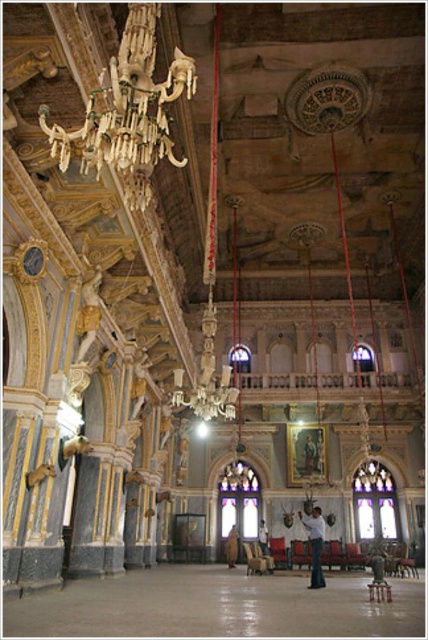
Question: Is light brown leather chair at center bigger than white fabric at center?

Choices:
 (A) no
 (B) yes

Answer: (B)

Question: Can you confirm if light brown leather jacket at center is positioned to the left of wooden framed portrait at center?

Choices:
 (A) no
 (B) yes

Answer: (B)

Question: Estimate the real-world distances between objects in this image. Which object is farther from the gold metallic chandelier at upper center?

Choices:
 (A) white fabric at center
 (B) wooden framed portrait at center
 (C) light brown leather chair at center
 (D) light brown leather jacket at center

Answer: (C)

Question: Estimate the real-world distances between objects in this image. Which object is closer to the light brown leather chair at center?

Choices:
 (A) wooden framed portrait at center
 (B) white fabric at center
 (C) gold metallic chandelier at upper center

Answer: (B)

Question: Which object is farther from the camera taking this photo?

Choices:
 (A) light brown leather chair at center
 (B) white fabric at center

Answer: (A)

Question: Can you confirm if gold metallic chandelier at upper center is positioned to the right of light brown leather chair at center?

Choices:
 (A) no
 (B) yes

Answer: (A)